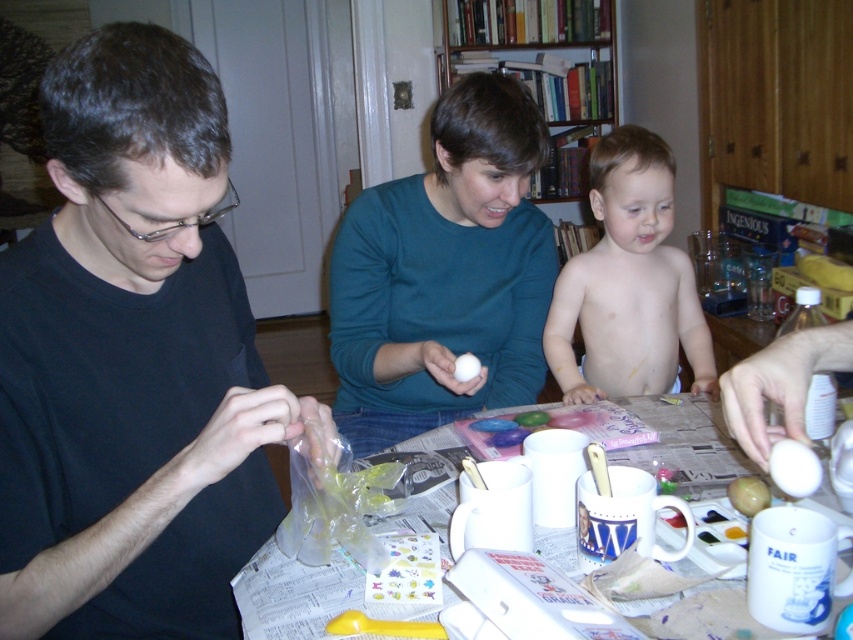
Is black matte shirt at left taller than teal matte sweater at center?

No, black matte shirt at left is not taller than teal matte sweater at center.

Which of these two, black matte shirt at left or teal matte sweater at center, stands shorter?

black matte shirt at left is shorter.

Where is `black matte shirt at left`? black matte shirt at left is located at coordinates (132, 362).

Who is more forward, (78, 212) or (807, 440)?

Point (78, 212) is more forward.

Does black matte shirt at left come in front of white glossy egg at center?

That is True.

Is point (131, 506) positioned before point (755, 372)?

Yes, point (131, 506) is in front of point (755, 372).

This screenshot has width=853, height=640. I want to click on black matte shirt at left, so click(132, 362).

Between teal matte sweater at center and white matte egg at center, which one has more height?

teal matte sweater at center is taller.

Does teal matte sweater at center appear over white matte egg at center?

Correct, teal matte sweater at center is located above white matte egg at center.

What are the coordinates of `teal matte sweater at center` in the screenshot? It's located at (444, 273).

What are the coordinates of `teal matte sweater at center` in the screenshot? It's located at (444, 273).